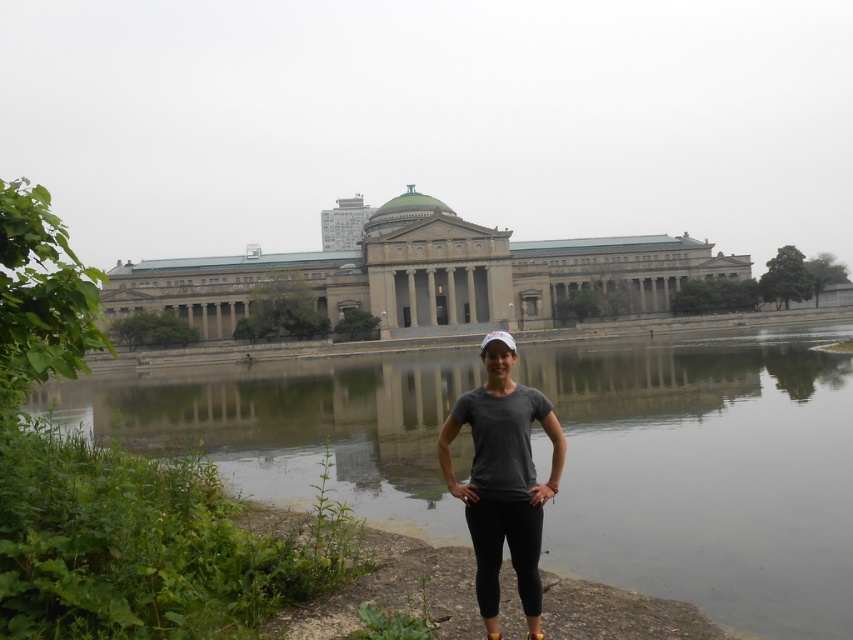
You are standing at the edge of the smooth concrete river at center and want to throw a frisbee to your friend who is standing 150 feet away from you. Can you reach them with one throw?

The smooth concrete river at center is 140.45 feet away from the viewer. Since your friend is 150 feet away, which is slightly farther than the river, you might need to throw a bit harder or take a step closer to ensure the frisbee reaches them.

You are a photographer planning to take a photo of the gray stone building at center. You want to ensure the smooth concrete river at center is visible in the background. Will the river be fully visible behind the building?

The smooth concrete river at center is not as tall as the gray stone building at center, so the river will be fully visible behind the building since it is shorter.